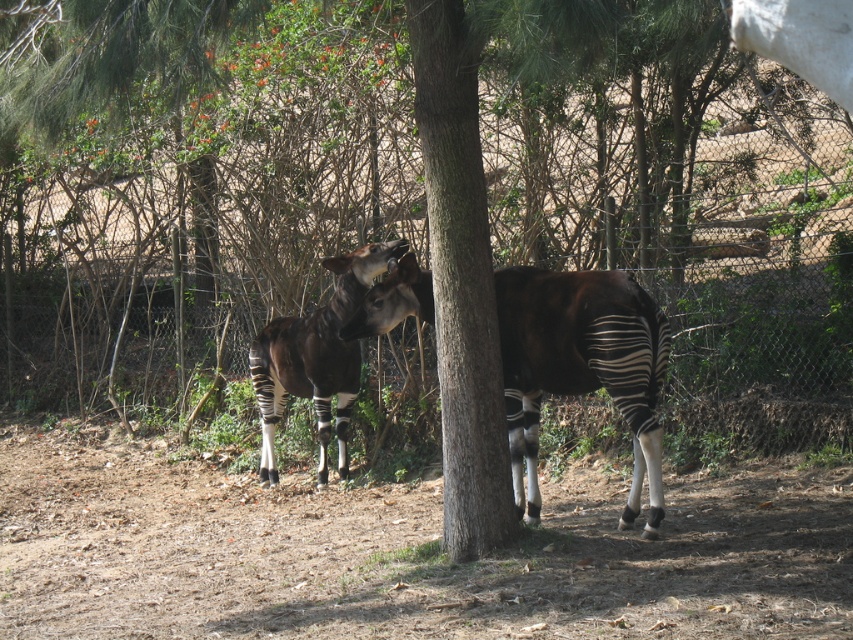
Does dark brown glossy okapi at center have a lesser width compared to black and white striped okapi at center?

Yes, dark brown glossy okapi at center is thinner than black and white striped okapi at center.

Is point (582, 333) positioned before point (364, 262)?

Yes, point (582, 333) is closer to viewer.

Locate an element on the screen. dark brown glossy okapi at center is located at coordinates (581, 365).

Is point (486, 486) more distant than point (636, 451)?

No, (486, 486) is closer to viewer.

Which is more to the right, brown rough tree trunk at center or dark brown glossy okapi at center?

dark brown glossy okapi at center is more to the right.

Who is more forward, [471,282] or [584,330]?

Point [471,282] is in front.

Find the location of a particular element. brown rough tree trunk at center is located at coordinates [461, 282].

Is brown rough tree trunk at center above black and white striped okapi at center?

Yes.

Between brown rough tree trunk at center and black and white striped okapi at center, which one has more height?

Standing taller between the two is brown rough tree trunk at center.

Is point (473, 442) less distant than point (268, 476)?

Yes, it is.

The image size is (853, 640). Identify the location of brown rough tree trunk at center. (461, 282).